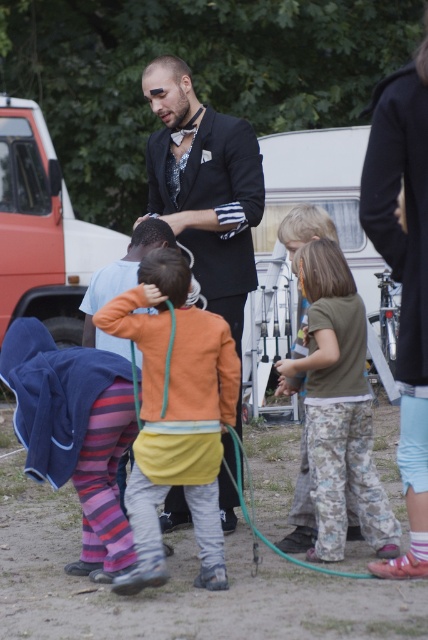
Question: Does orange cotton shirt at center appear over camouflage pants at center?

Choices:
 (A) no
 (B) yes

Answer: (A)

Question: Can you confirm if orange cotton shirt at center is positioned to the left of green rubber hose at lower center?

Choices:
 (A) no
 (B) yes

Answer: (B)

Question: Estimate the real-world distances between objects in this image. Which object is closer to the black satin suit at center?

Choices:
 (A) matte white van at left
 (B) orange cotton shirt at center
 (C) green rubber hose at lower center
 (D) camouflage pants at center

Answer: (D)

Question: Which point is closer to the camera taking this photo?

Choices:
 (A) (157, 80)
 (B) (186, 360)

Answer: (B)

Question: Does black satin suit at center have a greater width compared to matte white van at left?

Choices:
 (A) yes
 (B) no

Answer: (B)

Question: Which point appears closest to the camera in this image?

Choices:
 (A) (97, 259)
 (B) (314, 285)
 (C) (183, 60)
 (D) (219, 572)

Answer: (D)